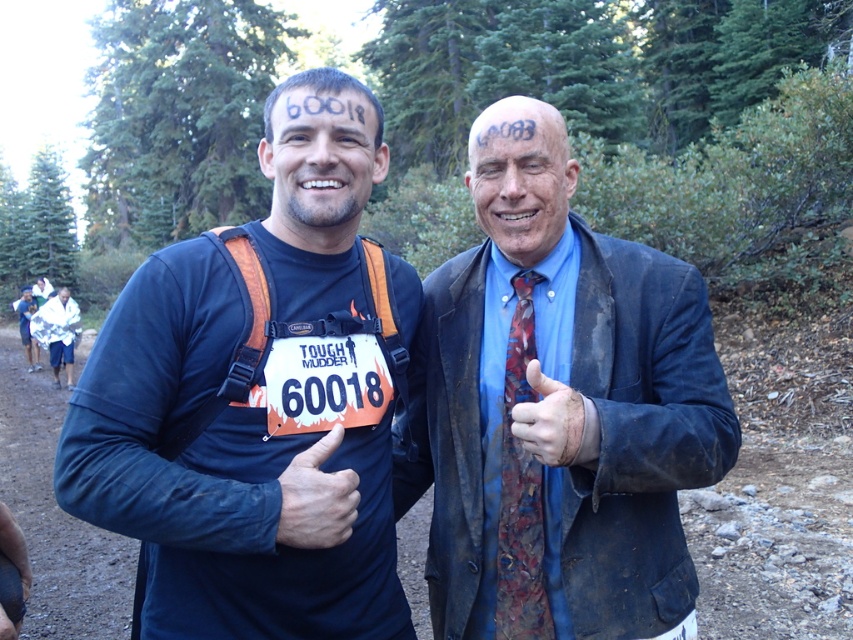
Question: Which object is positioned closest to the matte blue shirt at center?

Choices:
 (A) leather glove at center
 (B) matte black face at center
 (C) blue fabric shirt at left
 (D) smooth skin face at center

Answer: (B)

Question: Estimate the real-world distances between objects in this image. Which object is farther from the blue fabric shirt at left?

Choices:
 (A) leather glove at center
 (B) matte blue thumb at center
 (C) matte black face at center

Answer: (C)

Question: Where is smooth skin face at center located in relation to leather glove at center in the image?

Choices:
 (A) right
 (B) left

Answer: (B)

Question: Which of the following is the farthest from the observer?

Choices:
 (A) matte black face at center
 (B) matte blue shirt at center
 (C) blue fabric shirt at left

Answer: (C)

Question: Can you confirm if blue wrinkled suit at right is bigger than leather glove at center?

Choices:
 (A) yes
 (B) no

Answer: (A)

Question: Can you confirm if matte blue shirt at center is positioned above matte black face at center?

Choices:
 (A) yes
 (B) no

Answer: (B)